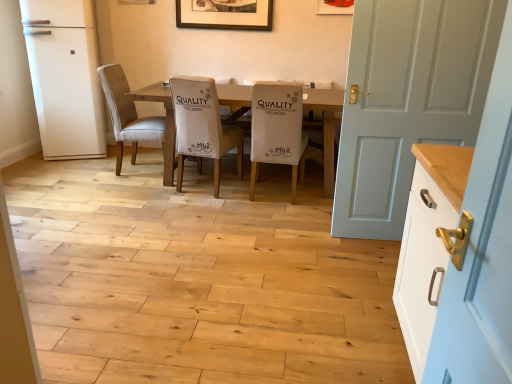
This screenshot has height=384, width=512. Find the location of `free area in between white matte refrigerator at left and white painted wood cabinet at right`. free area in between white matte refrigerator at left and white painted wood cabinet at right is located at coordinates (212, 240).